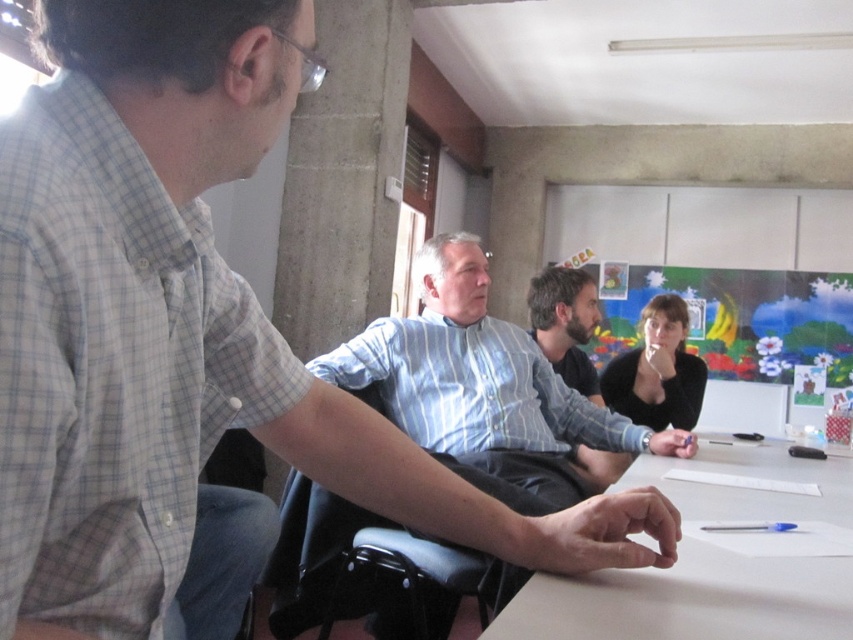
Question: Which object appears closest to the camera in this image?

Choices:
 (A) bearded man at center
 (B) white paper at center
 (C) black matte shirt at center

Answer: (B)

Question: Which of the following is the farthest from the observer?

Choices:
 (A) white paper at center
 (B) black matte shirt at center
 (C) black plastic chair at center

Answer: (B)

Question: In this image, where is striped cotton shirt at center located relative to black plastic chair at center?

Choices:
 (A) below
 (B) above

Answer: (B)

Question: Considering the relative positions of black plastic chair at center and black matte shirt at center in the image provided, where is black plastic chair at center located with respect to black matte shirt at center?

Choices:
 (A) below
 (B) above

Answer: (A)

Question: Which object is positioned farthest from the black matte shirt at center?

Choices:
 (A) white paper at center
 (B) striped cotton shirt at center

Answer: (B)

Question: From the image, what is the correct spatial relationship of black plastic chair at center in relation to bearded man at center?

Choices:
 (A) above
 (B) below

Answer: (B)